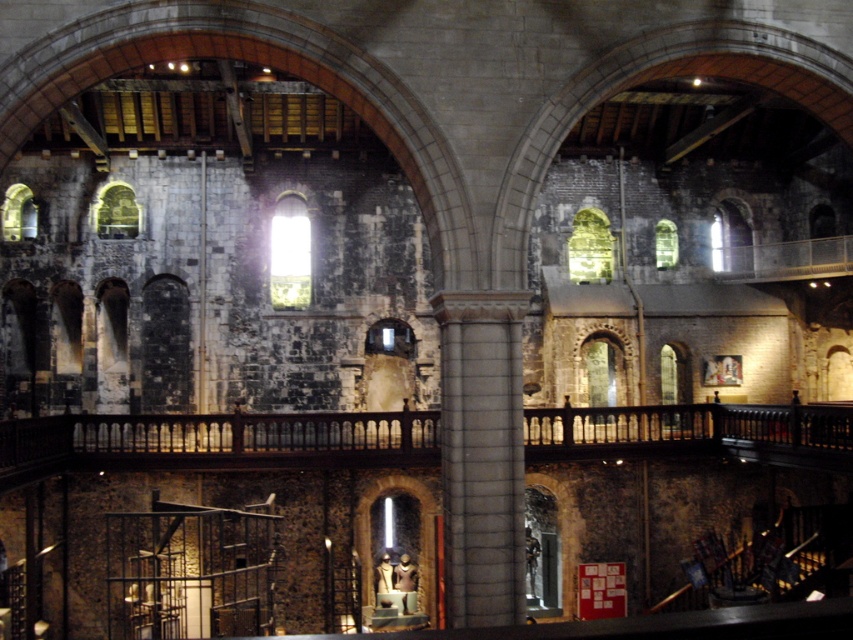
Does dark wood balustrade at center appear on the left side of gray stone column at center?

Correct, you'll find dark wood balustrade at center to the left of gray stone column at center.

Between point (236, 429) and point (514, 330), which one is positioned in front?

Point (514, 330) is more forward.

Locate an element on the screen. The width and height of the screenshot is (853, 640). dark wood balustrade at center is located at coordinates (x=213, y=442).